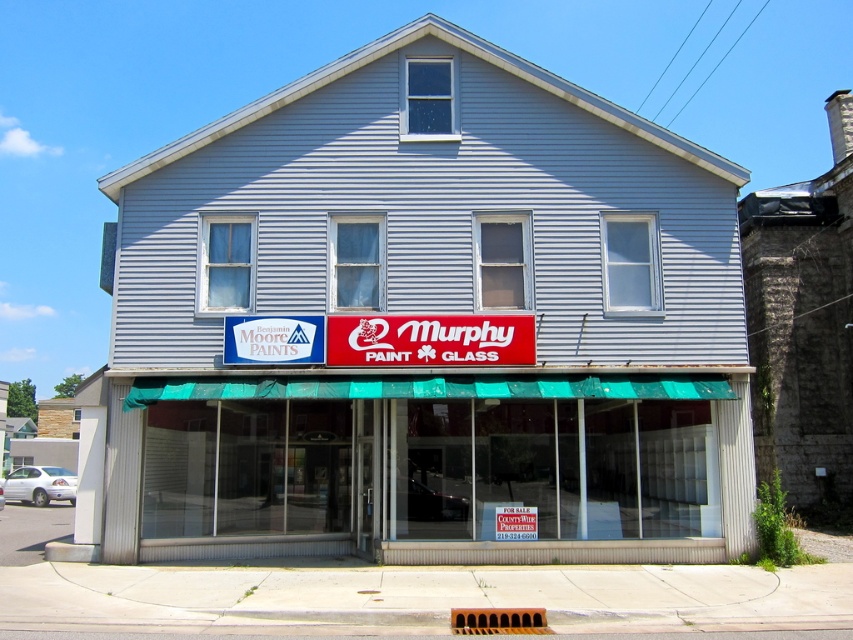
Which is behind, point (538, 170) or point (161, 464)?

Point (538, 170)

Based on the photo, which of these two, gray siding building at center or green awning at center, stands shorter?

green awning at center

What do you see at coordinates (427, 314) in the screenshot? The image size is (853, 640). I see `gray siding building at center` at bounding box center [427, 314].

You are a GUI agent. You are given a task and a screenshot of the screen. Output one action in this format:
    pyautogui.click(x=<x>, y=<y>)
    Task: Click on the gray siding building at center
    The image size is (853, 640).
    Given the screenshot: What is the action you would take?
    pyautogui.click(x=427, y=314)

Which is more to the right, green awning at center or red plastic sign at center?

From the viewer's perspective, green awning at center appears more on the right side.

From the picture: Who is more forward, (511, 454) or (415, 330)?

Positioned in front is point (415, 330).

Where is `green awning at center`? This screenshot has height=640, width=853. green awning at center is located at coordinates (432, 468).

Who is positioned more to the left, gray siding building at center or red plastic sign at center?

From the viewer's perspective, gray siding building at center appears more on the left side.

Which is behind, point (704, 540) or point (430, 317)?

The point (430, 317) is more distant.

At what (x,y) coordinates should I click in order to perform the action: click on gray siding building at center. Please return your answer as a coordinate pair (x, y). This screenshot has height=640, width=853. Looking at the image, I should click on (427, 314).